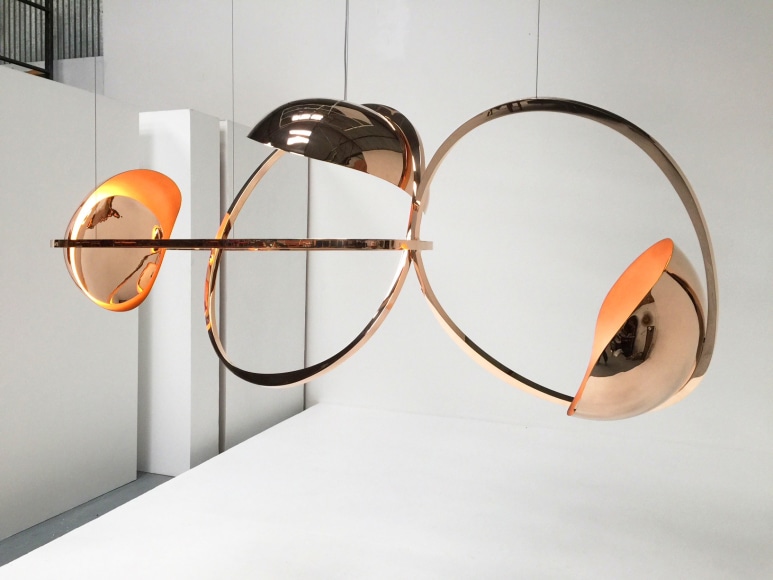
The height and width of the screenshot is (580, 773). I want to click on white countertop, so click(404, 489).